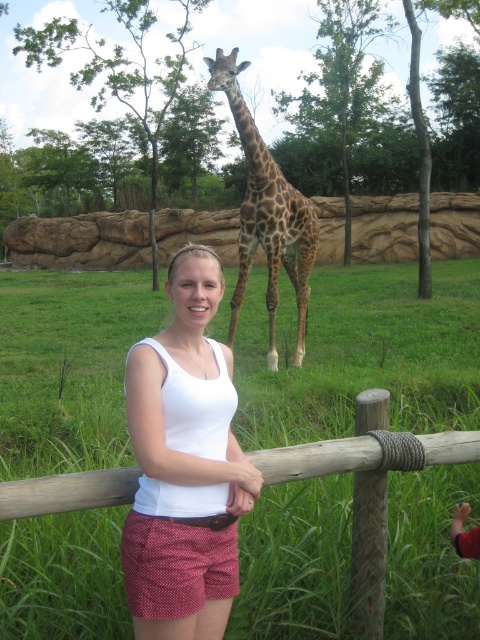
Question: Does wooden post at center have a larger size compared to spotted fur giraffe at center?

Choices:
 (A) no
 (B) yes

Answer: (A)

Question: Among these points, which one is farthest from the camera?

Choices:
 (A) (241, 291)
 (B) (208, 346)

Answer: (A)

Question: Does wooden post at center have a lesser width compared to wooden fence post at center?

Choices:
 (A) yes
 (B) no

Answer: (B)

Question: Which point is closer to the camera taking this photo?

Choices:
 (A) (262, 208)
 (B) (313, 513)
 (C) (354, 506)

Answer: (C)

Question: Is wooden post at center above white cotton tank top at center?

Choices:
 (A) yes
 (B) no

Answer: (B)

Question: Which of the following is the closest to the observer?

Choices:
 (A) wooden fence post at center
 (B) wooden post at center
 (C) spotted fur giraffe at center
 (D) white cotton tank top at center

Answer: (D)